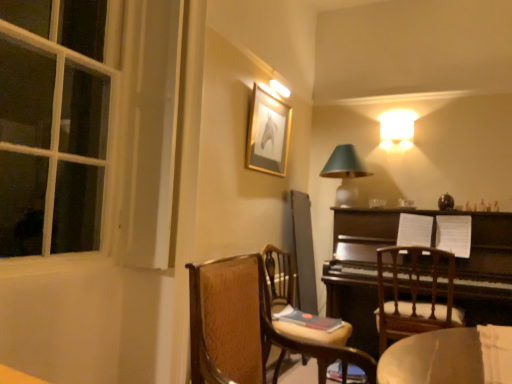
Question: From the image's perspective, is dark brown polished wood piano at right positioned above or below wooden chair at center, the 2th chair when ordered from back to front?

Choices:
 (A) below
 (B) above

Answer: (B)

Question: Is dark brown polished wood piano at right to the left or to the right of wooden chair at center, the 2th chair when ordered from back to front, in the image?

Choices:
 (A) right
 (B) left

Answer: (A)

Question: Which is farther from the wooden chair at right, the 3th chair positioned from the front?

Choices:
 (A) gold-framed picture at upper center
 (B) wooden chair at center, the 2th chair when ordered from back to front
 (C) wooden chair at center, placed as the 3th chair when sorted from back to front
 (D) matte green glass table lamp at upper right
 (E) dark brown polished wood piano at right

Answer: (A)

Question: Which object is the farthest from the wooden chair at center, the 2th chair when ordered from back to front?

Choices:
 (A) matte green glass table lamp at upper right
 (B) dark brown polished wood piano at right
 (C) wooden chair at center, placed as the 3th chair when sorted from back to front
 (D) wooden chair at right, the 3th chair positioned from the front
 (E) gold-framed picture at upper center

Answer: (A)